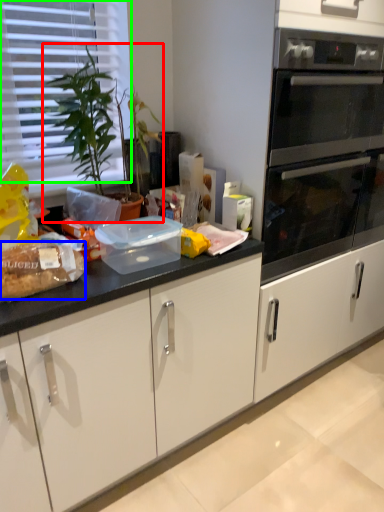
Question: Which object is the farthest from houseplant (highlighted by a red box)? Choose among these: food (highlighted by a blue box) or blind (highlighted by a green box).

Choices:
 (A) food
 (B) blind

Answer: (A)